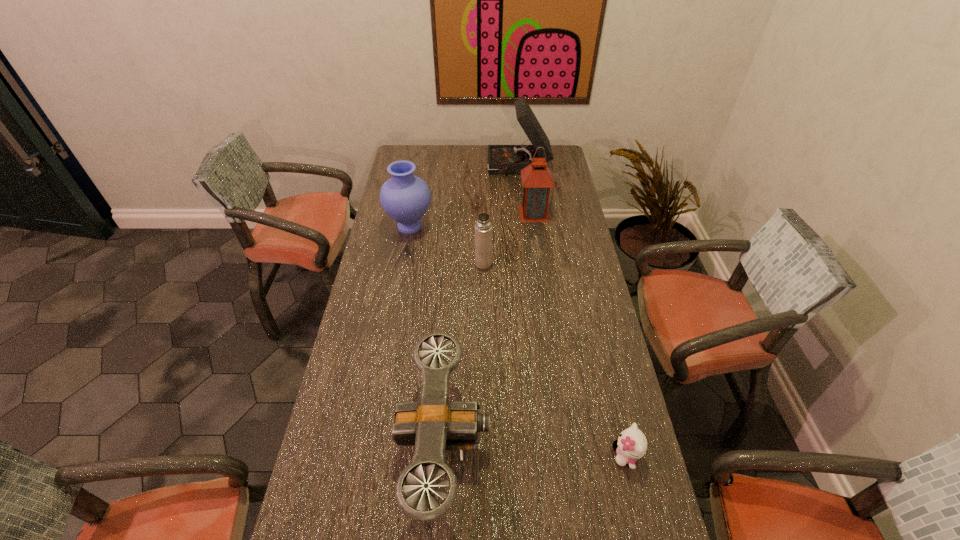
In order to click on kitten that is at the right edge in this screenshot , I will do `click(631, 445)`.

The height and width of the screenshot is (540, 960). What are the coordinates of `object situated at the far right corner` in the screenshot? It's located at (502, 159).

Locate an element on the screen. Image resolution: width=960 pixels, height=540 pixels. free space at the far edge is located at coordinates (444, 152).

This screenshot has height=540, width=960. Identify the location of blank space at the left edge of the desktop. (382, 329).

Identify the location of free space at the right edge of the desktop. This screenshot has height=540, width=960. (612, 347).

Locate an element on the screen. unoccupied position between the rightmost object and the phonograph_record is located at coordinates (572, 311).

The width and height of the screenshot is (960, 540). I want to click on free point between the rightmost object and the farthest object, so click(x=572, y=311).

Locate an element on the screen. vacant area that lies between the lantern and the vase is located at coordinates (471, 220).

What are the coordinates of `free spot between the vase and the shortest object` in the screenshot? It's located at (517, 341).

At what (x,y) coordinates should I click in order to perform the action: click on free point between the fourth tallest object and the rightmost object. Please return your answer as a coordinate pair (x, y). Looking at the image, I should click on (555, 359).